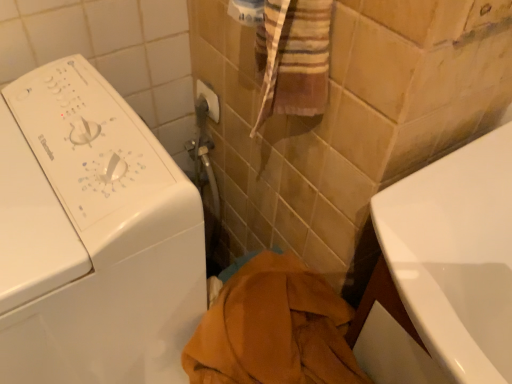
You are a GUI agent. You are given a task and a screenshot of the screen. Output one action in this format:
    pyautogui.click(x=<x>, y=<y>)
    Task: Click on the white glossy bathtub at lower right
    The image size is (512, 384).
    Given the screenshot: What is the action you would take?
    pyautogui.click(x=456, y=256)

Image resolution: width=512 pixels, height=384 pixels. In order to click on white plastic towel bar at upper center in this screenshot , I will do `click(209, 99)`.

In order to face brown cotton towel at center, should I rotate leftwards or rightwards?

You should rotate right by 1.434 degrees.

The height and width of the screenshot is (384, 512). What are the coordinates of `white glossy bathtub at lower right` in the screenshot? It's located at (456, 256).

Based on their sizes in the image, would you say white glossy bathtub at lower right is bigger or smaller than white glossy washing machine at left?

In the image, white glossy bathtub at lower right appears to be smaller than white glossy washing machine at left.

Can you tell me how much white glossy bathtub at lower right and white glossy washing machine at left differ in facing direction?

white glossy bathtub at lower right and white glossy washing machine at left are facing 1.49 degrees away from each other.

Is white glossy bathtub at lower right with white glossy washing machine at left?

No, white glossy bathtub at lower right is not beside white glossy washing machine at left.

Is point (500, 222) positioned behind point (85, 354)?

No.

Looking at the image, does white plastic towel bar at upper center seem bigger or smaller compared to brown cotton towel at center?

Clearly, white plastic towel bar at upper center is smaller in size than brown cotton towel at center.

Is white plastic towel bar at upper center aimed at brown cotton towel at center?

No, white plastic towel bar at upper center is not turned towards brown cotton towel at center.

Considering the relative positions of white plastic towel bar at upper center and brown cotton towel at center in the image provided, is white plastic towel bar at upper center to the right of brown cotton towel at center from the viewer's perspective?

Incorrect, white plastic towel bar at upper center is not on the right side of brown cotton towel at center.

From a real-world perspective, which is physically above, white plastic towel bar at upper center or brown cotton towel at center?

white plastic towel bar at upper center is physically above.

Are white glossy washing machine at left and brown cotton towel at center beside each other?

No, white glossy washing machine at left is not beside brown cotton towel at center.

Considering the points (97, 276) and (324, 347), which point is in front, point (97, 276) or point (324, 347)?

The point (97, 276) is closer.

Is white glossy washing machine at left oriented towards brown cotton towel at center?

No, white glossy washing machine at left is not facing towards brown cotton towel at center.

Which is correct: white glossy washing machine at left is inside brown cotton towel at center, or outside of it?

white glossy washing machine at left exists outside the volume of brown cotton towel at center.

Consider the image. Between white glossy bathtub at lower right and white plastic towel bar at upper center, which one appears on the left side from the viewer's perspective?

white plastic towel bar at upper center is more to the left.

From the picture: From a real-world perspective, who is located higher, white glossy bathtub at lower right or white plastic towel bar at upper center?

white plastic towel bar at upper center.

Considering the positions of objects white glossy bathtub at lower right and white plastic towel bar at upper center in the image provided, who is behind, white glossy bathtub at lower right or white plastic towel bar at upper center?

Positioned behind is white plastic towel bar at upper center.

Consider the image. How different are the orientations of white glossy bathtub at lower right and white plastic towel bar at upper center in degrees?

There is a 1.49-degree angle between the facing directions of white glossy bathtub at lower right and white plastic towel bar at upper center.

Between brown cotton towel at center and white plastic towel bar at upper center, which one has smaller width?

Thinner between the two is white plastic towel bar at upper center.

Is brown cotton towel at center next to white plastic towel bar at upper center?

brown cotton towel at center and white plastic towel bar at upper center are clearly separated.

From the image's perspective, is brown cotton towel at center located beneath white plastic towel bar at upper center?

Yes, from the image's perspective, brown cotton towel at center is beneath white plastic towel bar at upper center.

Find the location of a particular element. This screenshot has height=384, width=512. towel bar that is behind the brown cotton towel at center is located at coordinates (209, 99).

In terms of size, does brown cotton towel at center appear bigger or smaller than white glossy washing machine at left?

Considering their sizes, brown cotton towel at center takes up less space than white glossy washing machine at left.

In the scene shown: Is brown cotton towel at center thinner than white glossy washing machine at left?

Yes, brown cotton towel at center is thinner than white glossy washing machine at left.

Is the position of brown cotton towel at center more distant than that of white glossy washing machine at left?

Yes, brown cotton towel at center is behind white glossy washing machine at left.

Where is `bath located below the white glossy washing machine at left (from the image's perspective)`? The width and height of the screenshot is (512, 384). bath located below the white glossy washing machine at left (from the image's perspective) is located at coordinates (456, 256).

Which of these two, white glossy washing machine at left or white glossy bathtub at lower right, stands taller?

With more height is white glossy washing machine at left.

Considering the relative positions of white glossy washing machine at left and white glossy bathtub at lower right in the image provided, is white glossy washing machine at left to the left or to the right of white glossy bathtub at lower right?

From the image, it's evident that white glossy washing machine at left is to the left of white glossy bathtub at lower right.

In the image, is white glossy washing machine at left positioned in front of or behind white glossy bathtub at lower right?

In the image, white glossy washing machine at left appears in front of white glossy bathtub at lower right.

Where is `bath on the right of white glossy washing machine at left`? The image size is (512, 384). bath on the right of white glossy washing machine at left is located at coordinates (456, 256).

In the image, there is a white plastic towel bar at upper center. Where is `bath towel below it (from the image's perspective)`? The height and width of the screenshot is (384, 512). bath towel below it (from the image's perspective) is located at coordinates (274, 329).

Estimate the real-world distances between objects in this image. Which object is further from white plastic towel bar at upper center, white glossy bathtub at lower right or brown cotton towel at center?

white glossy bathtub at lower right.

When comparing their distances from white plastic towel bar at upper center, does brown cotton towel at center or white glossy washing machine at left seem closer?

white glossy washing machine at left lies closer to white plastic towel bar at upper center than the other object.

Which object lies further to the anchor point brown cotton towel at center, white plastic towel bar at upper center or white glossy washing machine at left?

white plastic towel bar at upper center is further to brown cotton towel at center.

From the image, which object appears to be farther from white glossy washing machine at left, white glossy bathtub at lower right or brown cotton towel at center?

Based on the image, white glossy bathtub at lower right appears to be further to white glossy washing machine at left.

Consider the image. Which object lies further to the anchor point white glossy bathtub at lower right, brown cotton towel at center or white glossy washing machine at left?

Based on the image, white glossy washing machine at left appears to be further to white glossy bathtub at lower right.

When comparing their distances from white glossy washing machine at left, does white plastic towel bar at upper center or brown cotton towel at center seem further?

Among the two, white plastic towel bar at upper center is located further to white glossy washing machine at left.

Based on their spatial positions, is white glossy bathtub at lower right or white plastic towel bar at upper center closer to white glossy washing machine at left?

white glossy bathtub at lower right.

Which object lies further to the anchor point white glossy bathtub at lower right, white glossy washing machine at left or brown cotton towel at center?

white glossy washing machine at left lies further to white glossy bathtub at lower right than the other object.

This screenshot has width=512, height=384. In order to click on bath towel between white glossy washing machine at left and white glossy bathtub at lower right in this screenshot , I will do `click(274, 329)`.

The image size is (512, 384). I want to click on towel bar situated between white glossy washing machine at left and white glossy bathtub at lower right from left to right, so click(x=209, y=99).

Locate an element on the screen. The width and height of the screenshot is (512, 384). washing machine that lies between white plastic towel bar at upper center and brown cotton towel at center from top to bottom is located at coordinates (92, 237).

Identify the location of bath between white plastic towel bar at upper center and brown cotton towel at center vertically. Image resolution: width=512 pixels, height=384 pixels. (456, 256).